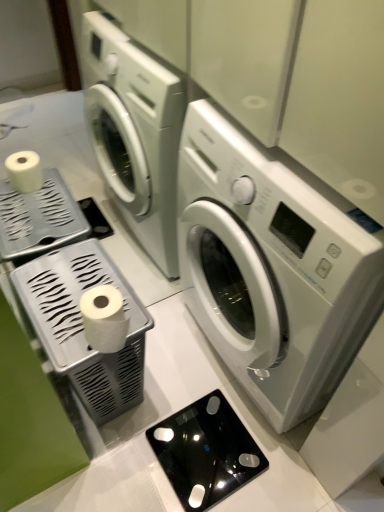
Locate an element on the screen. free space above white plastic tissue holder at left, which is the 2th appliance from right to left (from a real-world perspective) is located at coordinates (81, 287).